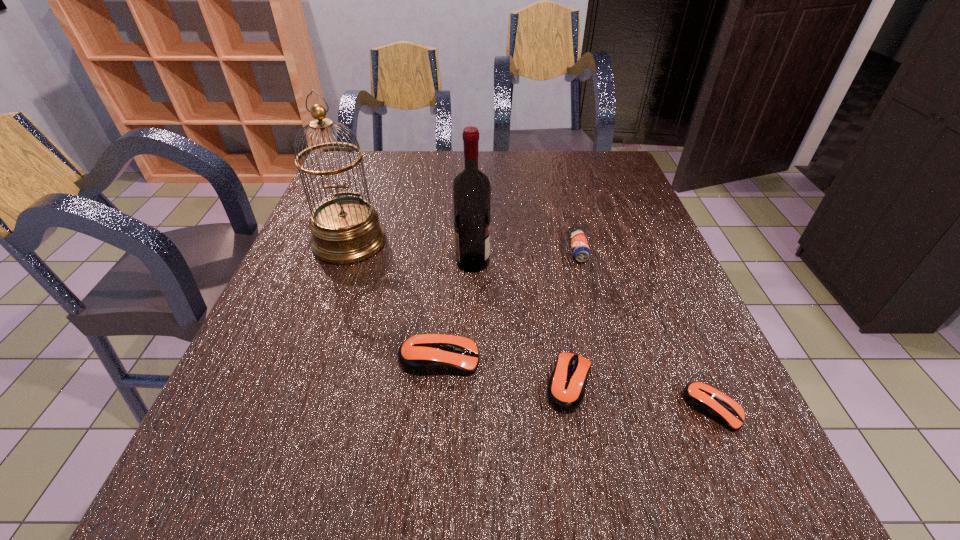
Locate an element on the screen. the tallest computer mouse is located at coordinates (425, 354).

Locate an element on the screen. Image resolution: width=960 pixels, height=540 pixels. the second computer mouse from left to right is located at coordinates (567, 384).

At what (x,y) coordinates should I click in order to perform the action: click on the third object from right to left. Please return your answer as a coordinate pair (x, y). Looking at the image, I should click on (567, 384).

At what (x,y) coordinates should I click in order to perform the action: click on the rightmost object. Please return your answer as a coordinate pair (x, y). Image resolution: width=960 pixels, height=540 pixels. Looking at the image, I should click on (705, 399).

You are a GUI agent. You are given a task and a screenshot of the screen. Output one action in this format:
    pyautogui.click(x=<x>, y=<y>)
    Task: Click on the shortest object
    The image size is (960, 540).
    Given the screenshot: What is the action you would take?
    pyautogui.click(x=705, y=399)

Locate an element on the screen. The width and height of the screenshot is (960, 540). the leftmost object is located at coordinates (346, 229).

At what (x,y) coordinates should I click in order to perform the action: click on alcohol. Please return your answer as a coordinate pair (x, y). The image size is (960, 540). Looking at the image, I should click on (471, 190).

Where is `beer can`? beer can is located at coordinates (580, 249).

You are a GUI agent. You are given a task and a screenshot of the screen. Output one action in this format:
    pyautogui.click(x=<x>, y=<y>)
    Task: Click on the free region located 0.280m on the left of the tallest computer mouse
    Image resolution: width=960 pixels, height=540 pixels.
    Given the screenshot: What is the action you would take?
    pyautogui.click(x=250, y=359)

You are a GUI agent. You are given a task and a screenshot of the screen. Output one action in this format:
    pyautogui.click(x=<x>, y=<y>)
    Task: Click on the blank space located 0.400m on the back of the second shortest object
    
    Given the screenshot: What is the action you would take?
    pyautogui.click(x=542, y=231)